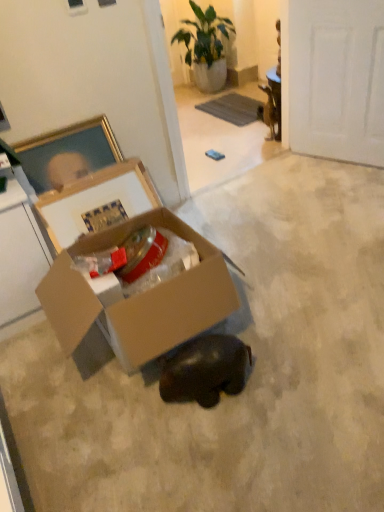
The width and height of the screenshot is (384, 512). I want to click on vacant space to the right of shiny black elephant at center, so point(283,376).